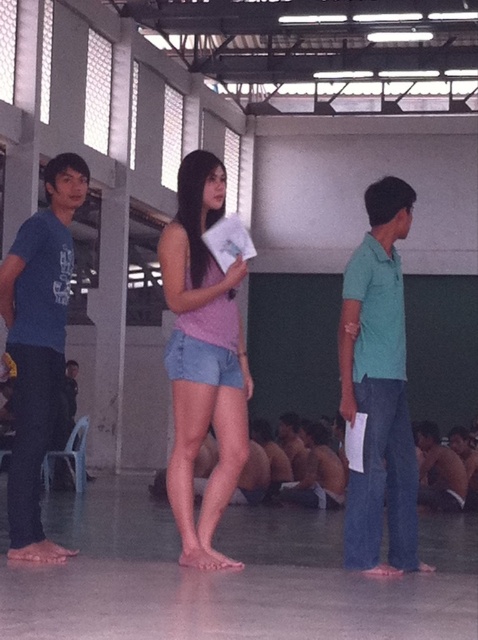
You are organizing a group photo and need to arrange the teal matte shirt at center and the matte blue shirt at left side by side. Based on their sizes, which one requires more space between them?

The teal matte shirt at center requires more space between them since it is wider than the matte blue shirt at left.

What are the coordinates of the teal matte shirt at center?

The teal matte shirt at center is located at coordinates point (x=379, y=388).

You are standing in the gymnasium and need to hand a document to the person wearing the denim shorts at center. Which direction should you move relative to the matte blue shirt at left?

The denim shorts at center is to the right of the matte blue shirt at left, so you should move to the right of the matte blue shirt at left to reach the denim shorts at center.